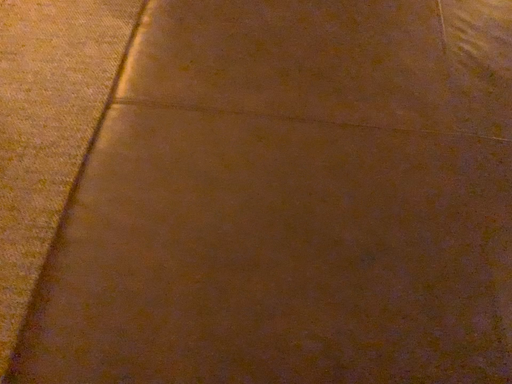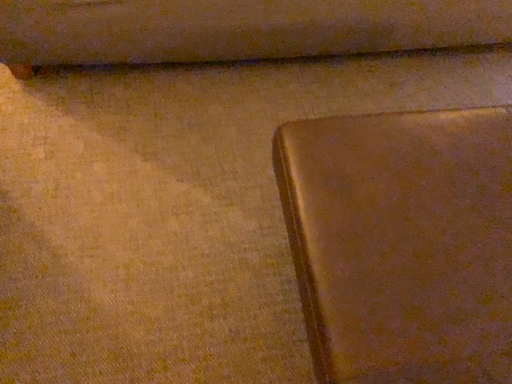
Question: Which way did the camera rotate in the video?

Choices:
 (A) rotated left
 (B) rotated right

Answer: (B)